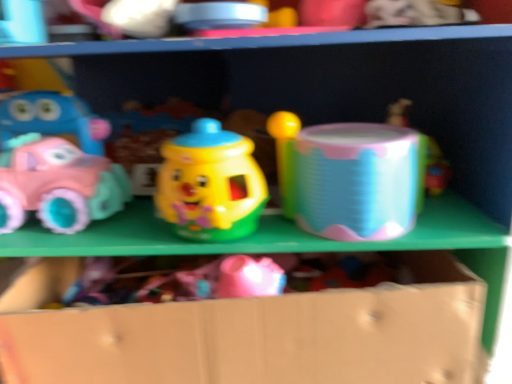
What do you see at coordinates (431, 168) in the screenshot? I see `translucent plastic cup at upper right, which is counted as the first toy, starting from the right` at bounding box center [431, 168].

In order to face shiny plastic toy at center, which is the second toy from left to right, should I rotate leftwards or rightwards?

Rotate your view left by about 5.768°.

Identify the location of cardboard box at lower center. (251, 332).

The height and width of the screenshot is (384, 512). In order to click on translucent plastic cup at upper right, which is counted as the first toy, starting from the right in this screenshot , I will do `click(431, 168)`.

Is cardboard box at lower center oriented away from holographic plastic drum at center, marked as the second toy in a right-to-left arrangement?

cardboard box at lower center does not have its back to holographic plastic drum at center, marked as the second toy in a right-to-left arrangement.

Is holographic plastic drum at center, marked as the second toy in a right-to-left arrangement, a part of cardboard box at lower center?

No.

Looking at this image, can you confirm if cardboard box at lower center is wider than holographic plastic drum at center, which appears as the third toy when viewed from the left?

Yes.

Can you confirm if cardboard box at lower center is bigger than holographic plastic drum at center, marked as the second toy in a right-to-left arrangement?

Yes.

Starting from the cardboard box at lower center, which toy is the 4th one behind? Please provide its 2D coordinates.

[(431, 168)]

How many degrees apart are the facing directions of cardboard box at lower center and translucent plastic cup at upper right, placed as the 4th toy when sorted from left to right?

4.23 degrees.

Is point (52, 276) closer or farther from the camera than point (430, 186)?

Clearly, point (52, 276) is closer to the camera than point (430, 186).

From a real-world perspective, who is located higher, shiny plastic toy at center, which is the 3th toy in right-to-left order, or cardboard box at lower center?

shiny plastic toy at center, which is the 3th toy in right-to-left order.

Looking at this image, considering the sizes of shiny plastic toy at center, which is the second toy from left to right, and cardboard box at lower center in the image, is shiny plastic toy at center, which is the second toy from left to right, bigger or smaller than cardboard box at lower center?

Considering their sizes, shiny plastic toy at center, which is the second toy from left to right, takes up less space than cardboard box at lower center.

Is shiny plastic toy at center, which is the second toy from left to right, facing towards cardboard box at lower center?

No, shiny plastic toy at center, which is the second toy from left to right, is not turned towards cardboard box at lower center.

Who is bigger, shiny plastic toy at center, which is the second toy from left to right, or translucent plastic cup at upper right, placed as the 4th toy when sorted from left to right?

shiny plastic toy at center, which is the second toy from left to right, is bigger.

Which of these two, shiny plastic toy at center, which is the 3th toy in right-to-left order, or translucent plastic cup at upper right, placed as the 4th toy when sorted from left to right, stands shorter?

translucent plastic cup at upper right, placed as the 4th toy when sorted from left to right, is shorter.

Considering the positions of points (194, 170) and (402, 112), is point (194, 170) closer to camera compared to point (402, 112)?

Yes, it is.

Would you say translucent plastic cup at upper right, which is counted as the first toy, starting from the right, is part of shiny plastic toy at center, which is the second toy from left to right,'s contents?

No.

From a real-world perspective, between shiny plastic toy at center, which is the second toy from left to right, and holographic plastic drum at center, which appears as the third toy when viewed from the left, who is vertically higher?

In real-world perspective, shiny plastic toy at center, which is the second toy from left to right, is above.

Which is behind, point (221, 178) or point (319, 175)?

The point (319, 175) is farther from the camera.

Which object is closer to the camera, shiny plastic toy at center, which is the 3th toy in right-to-left order, or holographic plastic drum at center, which appears as the third toy when viewed from the left?

shiny plastic toy at center, which is the 3th toy in right-to-left order, is in front.

Which object is positioned more to the right, matte pink plastic car at left, which is the fourth toy from right to left, or translucent plastic cup at upper right, which is counted as the first toy, starting from the right?

Positioned to the right is translucent plastic cup at upper right, which is counted as the first toy, starting from the right.

From a real-world perspective, is matte pink plastic car at left, which is the fourth toy from right to left, positioned above or below translucent plastic cup at upper right, which is counted as the first toy, starting from the right?

Clearly, from a real-world perspective, matte pink plastic car at left, which is the fourth toy from right to left, is above translucent plastic cup at upper right, which is counted as the first toy, starting from the right.

From the image's perspective, which object appears higher, matte pink plastic car at left, the 1th toy in the left-to-right sequence, or translucent plastic cup at upper right, which is counted as the first toy, starting from the right?

translucent plastic cup at upper right, which is counted as the first toy, starting from the right, from the image's perspective.

Is matte pink plastic car at left, the 1th toy in the left-to-right sequence, positioned far away from translucent plastic cup at upper right, placed as the 4th toy when sorted from left to right?

That's not correct — matte pink plastic car at left, the 1th toy in the left-to-right sequence, is a little close to translucent plastic cup at upper right, placed as the 4th toy when sorted from left to right.

Which is less distant, (316, 156) or (218, 145)?

Point (316, 156).

From a real-world perspective, count 1st toys downward from the shiny plastic toy at center, which is the 3th toy in right-to-left order, and point to it. Please provide its 2D coordinates.

[(348, 178)]

How many degrees apart are the facing directions of holographic plastic drum at center, marked as the second toy in a right-to-left arrangement, and shiny plastic toy at center, which is the 3th toy in right-to-left order?

0.00288 degrees.

From a real-world perspective, is holographic plastic drum at center, marked as the second toy in a right-to-left arrangement, located higher than shiny plastic toy at center, which is the second toy from left to right?

No, from a real-world perspective, holographic plastic drum at center, marked as the second toy in a right-to-left arrangement, is not above shiny plastic toy at center, which is the second toy from left to right.

Locate an element on the screen. cardboard box that is under the holographic plastic drum at center, marked as the second toy in a right-to-left arrangement (from a real-world perspective) is located at coordinates (251, 332).

In order to click on the 2nd toy counting from the right side of the cardboard box at lower center in this screenshot , I will do `click(431, 168)`.

Which object lies nearer to the anchor point cardboard box at lower center, holographic plastic drum at center, marked as the second toy in a right-to-left arrangement, or translucent plastic cup at upper right, placed as the 4th toy when sorted from left to right?

holographic plastic drum at center, marked as the second toy in a right-to-left arrangement, is closer to cardboard box at lower center.

Looking at the image, which one is located further to shiny plastic toy at center, which is the second toy from left to right, matte pink plastic car at left, which is the fourth toy from right to left, or translucent plastic cup at upper right, placed as the 4th toy when sorted from left to right?

translucent plastic cup at upper right, placed as the 4th toy when sorted from left to right.

Estimate the real-world distances between objects in this image. Which object is further from matte pink plastic car at left, the 1th toy in the left-to-right sequence, shiny plastic toy at center, which is the second toy from left to right, or holographic plastic drum at center, marked as the second toy in a right-to-left arrangement?

The object further to matte pink plastic car at left, the 1th toy in the left-to-right sequence, is holographic plastic drum at center, marked as the second toy in a right-to-left arrangement.

Considering their positions, is cardboard box at lower center positioned further to shiny plastic toy at center, which is the 3th toy in right-to-left order, than translucent plastic cup at upper right, which is counted as the first toy, starting from the right?

translucent plastic cup at upper right, which is counted as the first toy, starting from the right, is further to shiny plastic toy at center, which is the 3th toy in right-to-left order.

Considering their positions, is shiny plastic toy at center, which is the 3th toy in right-to-left order, positioned closer to cardboard box at lower center than translucent plastic cup at upper right, which is counted as the first toy, starting from the right?

shiny plastic toy at center, which is the 3th toy in right-to-left order, is closer to cardboard box at lower center.

Considering their positions, is matte pink plastic car at left, which is the fourth toy from right to left, positioned closer to holographic plastic drum at center, marked as the second toy in a right-to-left arrangement, than translucent plastic cup at upper right, which is counted as the first toy, starting from the right?

Among the two, translucent plastic cup at upper right, which is counted as the first toy, starting from the right, is located nearer to holographic plastic drum at center, marked as the second toy in a right-to-left arrangement.

Which object lies further to the anchor point translucent plastic cup at upper right, placed as the 4th toy when sorted from left to right, matte pink plastic car at left, which is the fourth toy from right to left, or cardboard box at lower center?

Based on the image, matte pink plastic car at left, which is the fourth toy from right to left, appears to be further to translucent plastic cup at upper right, placed as the 4th toy when sorted from left to right.

Estimate the real-world distances between objects in this image. Which object is closer to translucent plastic cup at upper right, which is counted as the first toy, starting from the right, holographic plastic drum at center, which appears as the third toy when viewed from the left, or shiny plastic toy at center, which is the 3th toy in right-to-left order?

Based on the image, holographic plastic drum at center, which appears as the third toy when viewed from the left, appears to be nearer to translucent plastic cup at upper right, which is counted as the first toy, starting from the right.

Image resolution: width=512 pixels, height=384 pixels. I want to click on cardboard box between shiny plastic toy at center, which is the 3th toy in right-to-left order, and holographic plastic drum at center, which appears as the third toy when viewed from the left, from left to right, so click(x=251, y=332).

Identify the location of cardboard box between shiny plastic toy at center, which is the second toy from left to right, and translucent plastic cup at upper right, placed as the 4th toy when sorted from left to right, in the horizontal direction. (251, 332).

The width and height of the screenshot is (512, 384). Find the location of `toy located between matte pink plastic car at left, the 1th toy in the left-to-right sequence, and holographic plastic drum at center, marked as the second toy in a right-to-left arrangement, in the left-right direction`. toy located between matte pink plastic car at left, the 1th toy in the left-to-right sequence, and holographic plastic drum at center, marked as the second toy in a right-to-left arrangement, in the left-right direction is located at coordinates (210, 184).

Image resolution: width=512 pixels, height=384 pixels. In order to click on toy between shiny plastic toy at center, which is the 3th toy in right-to-left order, and translucent plastic cup at upper right, placed as the 4th toy when sorted from left to right, from left to right in this screenshot , I will do `click(348, 178)`.